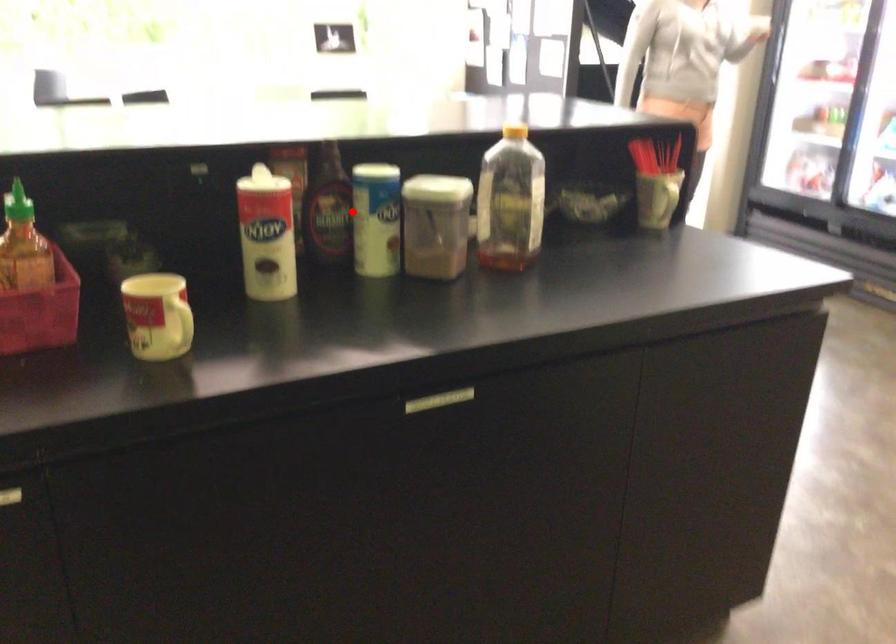
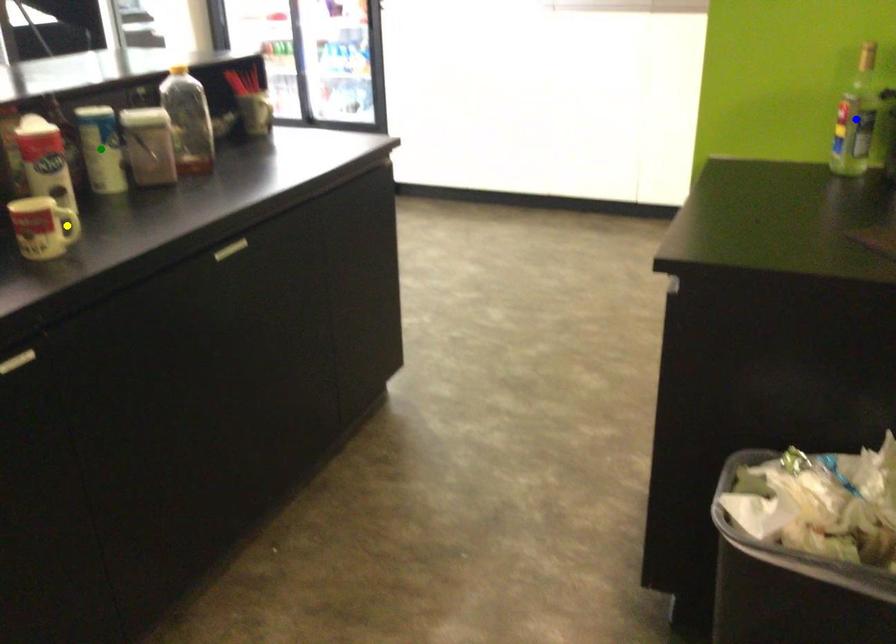
Question: I am providing you with two images of the same scene from different viewpoints. A red point is marked on the first image. You are given multiple points on the second image. Which mark in image 2 goes with the point in image 1?

Choices:
 (A) yellow point
 (B) green point
 (C) blue point

Answer: (B)